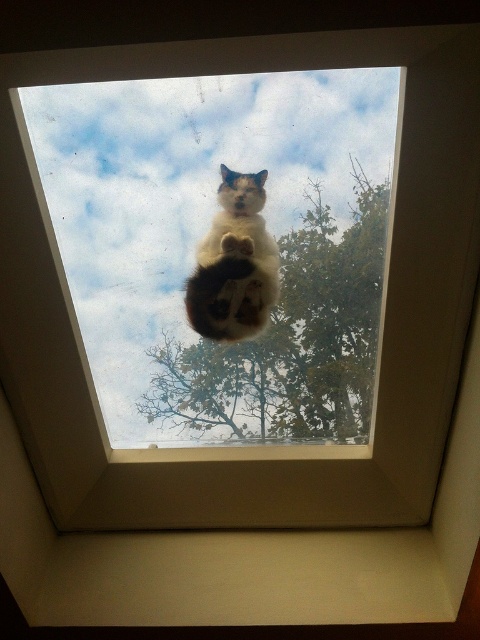
Question: Does green leafy tree at center appear over white fur cat at center?

Choices:
 (A) no
 (B) yes

Answer: (A)

Question: Which of the following is the farthest from the observer?

Choices:
 (A) green leafy tree at center
 (B) white fur cat at center

Answer: (B)

Question: Is green leafy tree at center thinner than white fur cat at center?

Choices:
 (A) no
 (B) yes

Answer: (A)

Question: Which object appears farthest from the camera in this image?

Choices:
 (A) white fur cat at center
 (B) green leafy tree at center

Answer: (A)

Question: Which point appears farthest from the camera in this image?

Choices:
 (A) (233, 273)
 (B) (276, 266)

Answer: (B)

Question: Can you confirm if green leafy tree at center is bigger than white fur cat at center?

Choices:
 (A) no
 (B) yes

Answer: (B)